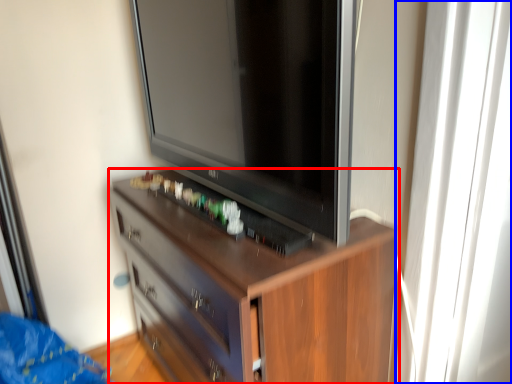
Question: Which object is closer to the camera taking this photo, chest of drawers (highlighted by a red box) or glass door (highlighted by a blue box)?

Choices:
 (A) chest of drawers
 (B) glass door

Answer: (A)